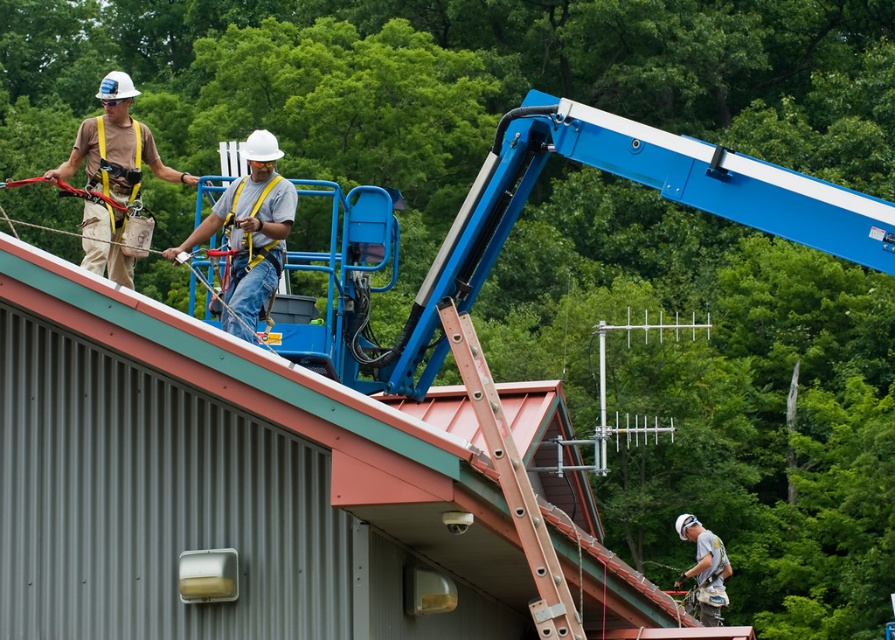
Question: Is white hard hat at center in front of metallic orange ladder at center?

Choices:
 (A) yes
 (B) no

Answer: (B)

Question: Which point appears closest to the camera in this image?

Choices:
 (A) (111, 236)
 (B) (233, 266)
 (C) (712, 579)
 (D) (530, 540)

Answer: (D)

Question: Which point is closer to the camera?

Choices:
 (A) white hard hat at center
 (B) matte khaki pants at upper left
 (C) metallic orange ladder at center
 (D) white matte helmet at lower right

Answer: (C)

Question: Does white hard hat at center come in front of white matte helmet at lower right?

Choices:
 (A) no
 (B) yes

Answer: (B)

Question: Is metallic orange ladder at center to the left of matte khaki pants at upper left from the viewer's perspective?

Choices:
 (A) no
 (B) yes

Answer: (A)

Question: Among these points, which one is nearest to the camera?

Choices:
 (A) (703, 605)
 (B) (104, 109)

Answer: (B)